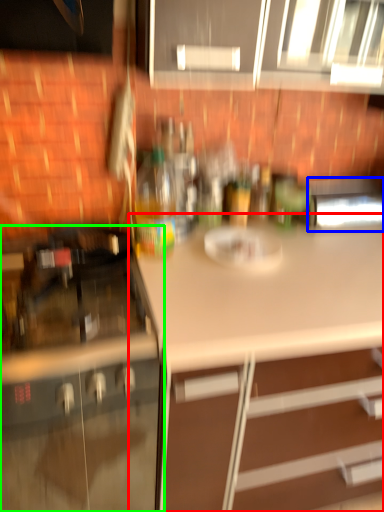
Question: Based on their relative distances, which object is farther from countertop (highlighted by a red box)? Choose from appliance (highlighted by a blue box) and cabinetry (highlighted by a green box).

Choices:
 (A) appliance
 (B) cabinetry

Answer: (A)